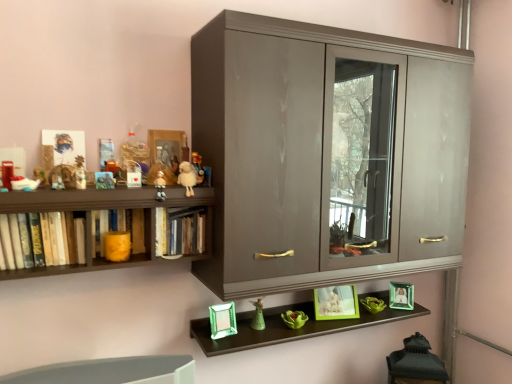
Question: Considering the relative sizes of fluffy white lamb at upper center, which is the 4th toy from back to front, and glossy wood cupboard at center in the image provided, is fluffy white lamb at upper center, which is the 4th toy from back to front, thinner than glossy wood cupboard at center?

Choices:
 (A) yes
 (B) no

Answer: (A)

Question: Is fluffy white lamb at upper center, marked as the third toy in a top-to-bottom arrangement, shorter than glossy wood cupboard at center?

Choices:
 (A) no
 (B) yes

Answer: (B)

Question: Can you confirm if fluffy white lamb at upper center, the fourth toy when ordered from front to back, is positioned to the right of glossy wood cupboard at center?

Choices:
 (A) no
 (B) yes

Answer: (A)

Question: Is fluffy white lamb at upper center, marked as the fifth toy in a left-to-right arrangement, not inside glossy wood cupboard at center?

Choices:
 (A) no
 (B) yes

Answer: (B)

Question: Is fluffy white lamb at upper center, marked as the 3th toy in a right-to-left arrangement, facing away from glossy wood cupboard at center?

Choices:
 (A) yes
 (B) no

Answer: (B)

Question: From the image's perspective, does fluffy white lamb at upper center, marked as the 3th toy in a right-to-left arrangement, appear lower than glossy wood cupboard at center?

Choices:
 (A) no
 (B) yes

Answer: (B)

Question: From a real-world perspective, is matte plastic toy at upper center, the 5th toy positioned from the back, under matte plastic toy at upper left, the 6th toy when ordered from right to left?

Choices:
 (A) yes
 (B) no

Answer: (A)

Question: Does matte plastic toy at upper center, positioned as the third toy in front-to-back order, have a lesser height compared to matte plastic toy at upper left, which is counted as the 2th toy, starting from the top?

Choices:
 (A) no
 (B) yes

Answer: (A)

Question: Is matte plastic toy at upper center, placed as the sixth toy when sorted from top to bottom, oriented towards matte plastic toy at upper left, the second toy in the left-to-right sequence?

Choices:
 (A) no
 (B) yes

Answer: (A)

Question: From a real-world perspective, is matte plastic toy at upper center, which is the 4th toy from right to left, on matte plastic toy at upper left, the second toy in the left-to-right sequence?

Choices:
 (A) yes
 (B) no

Answer: (B)

Question: Is matte plastic toy at upper center, arranged as the second toy when ordered from the bottom, thinner than matte plastic toy at upper left, the 6th toy when ordered from bottom to top?

Choices:
 (A) no
 (B) yes

Answer: (A)

Question: Is matte plastic toy at upper center, the 5th toy positioned from the back, positioned before matte plastic toy at upper left, acting as the 3th toy starting from the back?

Choices:
 (A) yes
 (B) no

Answer: (A)

Question: Is green glass photo frame at lower right, placed as the first picture frame when sorted from bottom to top, bigger than glossy wood cupboard at center?

Choices:
 (A) yes
 (B) no

Answer: (B)